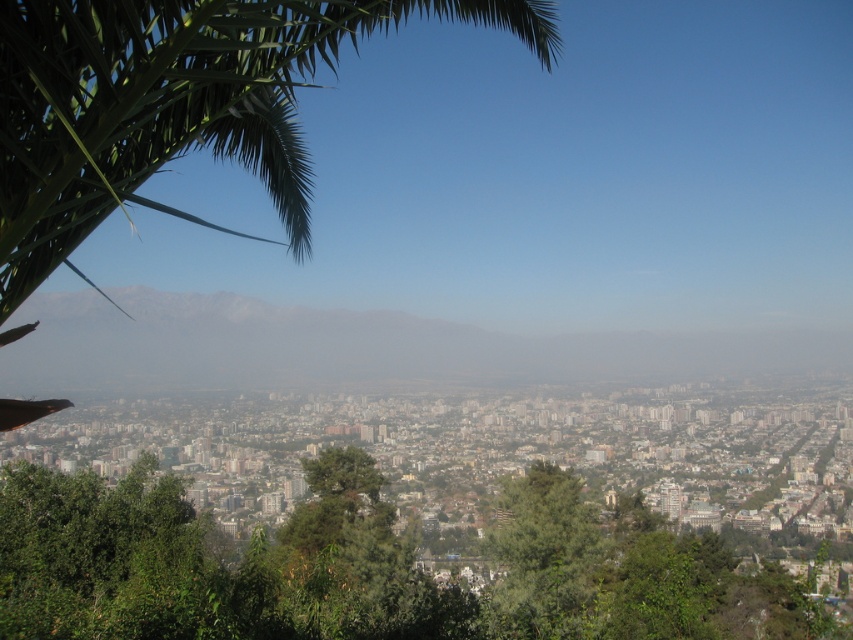
Does point (126, 570) lie behind point (100, 45)?

Yes, it is.

Is point (119, 577) positioned in front of point (175, 38)?

No, it is behind (175, 38).

What are the coordinates of `green leafy tree at center` in the screenshot? It's located at (363, 570).

Is green leafy tree at center taller than gray foggy mountain at center?

Correct, green leafy tree at center is much taller as gray foggy mountain at center.

Does green leafy tree at center appear on the left side of gray foggy mountain at center?

Correct, you'll find green leafy tree at center to the left of gray foggy mountain at center.

Locate an element on the screen. green leafy tree at center is located at coordinates (363, 570).

Which is more to the left, green leafy palm tree at upper left or gray foggy mountain at center?

green leafy palm tree at upper left is more to the left.

Describe the element at coordinates (173, 104) in the screenshot. The image size is (853, 640). I see `green leafy palm tree at upper left` at that location.

You are a GUI agent. You are given a task and a screenshot of the screen. Output one action in this format:
    pyautogui.click(x=<x>, y=<y>)
    Task: Click on the green leafy palm tree at upper left
    This screenshot has height=640, width=853.
    Given the screenshot: What is the action you would take?
    pyautogui.click(x=173, y=104)

You are a GUI agent. You are given a task and a screenshot of the screen. Output one action in this format:
    pyautogui.click(x=<x>, y=<y>)
    Task: Click on the green leafy palm tree at upper left
    This screenshot has width=853, height=640.
    Given the screenshot: What is the action you would take?
    pyautogui.click(x=173, y=104)